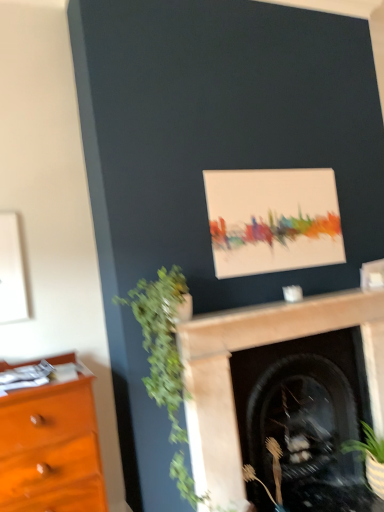
Question: From a real-world perspective, is matte canvas painting at upper center over green leafy plant at left, which ranks as the 1th plant in left-to-right order?

Choices:
 (A) yes
 (B) no

Answer: (A)

Question: Is matte canvas painting at upper center positioned before green leafy plant at left, which ranks as the 1th plant in left-to-right order?

Choices:
 (A) no
 (B) yes

Answer: (A)

Question: Is matte canvas painting at upper center positioned behind green leafy plant at left, which ranks as the 1th plant in left-to-right order?

Choices:
 (A) yes
 (B) no

Answer: (A)

Question: From a real-world perspective, is matte canvas painting at upper center below green leafy plant at left, which is the first plant in top-to-bottom order?

Choices:
 (A) no
 (B) yes

Answer: (A)

Question: Is matte canvas painting at upper center taller than green leafy plant at left, which is the first plant in top-to-bottom order?

Choices:
 (A) no
 (B) yes

Answer: (A)

Question: Is matte canvas painting at upper center far away from green leafy plant at left, which ranks as the 1th plant in left-to-right order?

Choices:
 (A) yes
 (B) no

Answer: (B)

Question: From a real-world perspective, is green leafy plant at left, arranged as the 2th plant when viewed from the right, positioned over matte canvas painting at upper center based on gravity?

Choices:
 (A) yes
 (B) no

Answer: (B)

Question: Is green leafy plant at left, arranged as the 2th plant when viewed from the right, outside matte canvas painting at upper center?

Choices:
 (A) no
 (B) yes

Answer: (B)

Question: Does green leafy plant at left, arranged as the 2th plant when viewed from the right, appear on the left side of matte canvas painting at upper center?

Choices:
 (A) yes
 (B) no

Answer: (A)

Question: Are green leafy plant at left, arranged as the 2th plant when viewed from the right, and matte canvas painting at upper center beside each other?

Choices:
 (A) yes
 (B) no

Answer: (B)

Question: Is matte canvas painting at upper center completely or partially inside green leafy plant at left, arranged as the 2th plant when viewed from the right?

Choices:
 (A) yes
 (B) no

Answer: (B)

Question: Is green leafy plant at left, arranged as the 2th plant when viewed from the right, oriented away from matte canvas painting at upper center?

Choices:
 (A) no
 (B) yes

Answer: (A)

Question: Considering the relative sizes of brown textured plant at lower center, acting as the first plant starting from the right, and green leafy plant at left, placed as the second plant when sorted from bottom to top, in the image provided, is brown textured plant at lower center, acting as the first plant starting from the right, bigger than green leafy plant at left, placed as the second plant when sorted from bottom to top,?

Choices:
 (A) no
 (B) yes

Answer: (A)